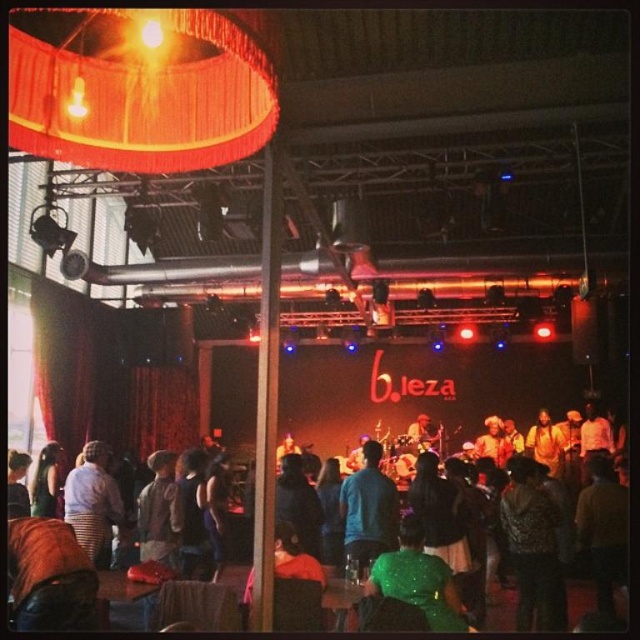
Between point (88, 541) and point (230, 604), which one is positioned behind?

Positioned behind is point (88, 541).

At what (x,y) coordinates should I click in order to perform the action: click on striped shirt at lower left. Please return your answer as a coordinate pair (x, y). The image size is (640, 640). Looking at the image, I should click on (92, 502).

Is point (355, 548) in front of point (588, 588)?

Yes, it is.

Between point (352, 481) and point (508, 627), which one is positioned in front?

Point (352, 481) is in front.

This screenshot has width=640, height=640. What do you see at coordinates (369, 508) in the screenshot? I see `blue denim jacket at center` at bounding box center [369, 508].

You are a GUI agent. You are given a task and a screenshot of the screen. Output one action in this format:
    pyautogui.click(x=<x>, y=<y>)
    Task: Click on the blue denim jacket at center
    The image size is (640, 640).
    Given the screenshot: What is the action you would take?
    pyautogui.click(x=369, y=508)

Based on the photo, is blue denim jacket at center closer to camera compared to striped shirt at lower left?

That is True.

Does point (388, 522) come farther from viewer compared to point (72, 496)?

No.

At what (x,y) coordinates should I click in order to perform the action: click on blue denim jacket at center. Please return your answer as a coordinate pair (x, y). This screenshot has height=640, width=640. Looking at the image, I should click on (369, 508).